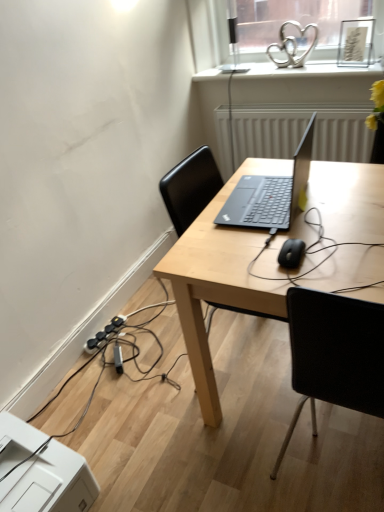
The height and width of the screenshot is (512, 384). I want to click on vacant point above white textured radiator at center (from a real-world perspective), so click(x=301, y=101).